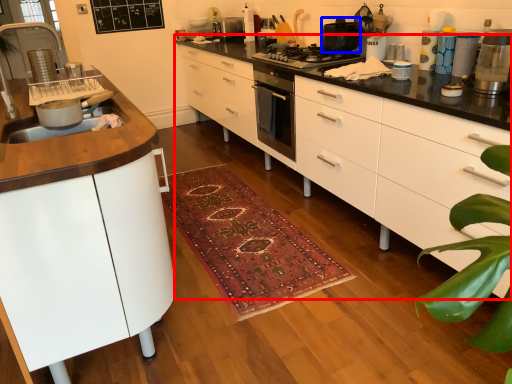
Question: Which object appears farthest to the camera in this image, chest of drawers (highlighted by a red box) or kitchen appliance (highlighted by a blue box)?

Choices:
 (A) chest of drawers
 (B) kitchen appliance

Answer: (B)